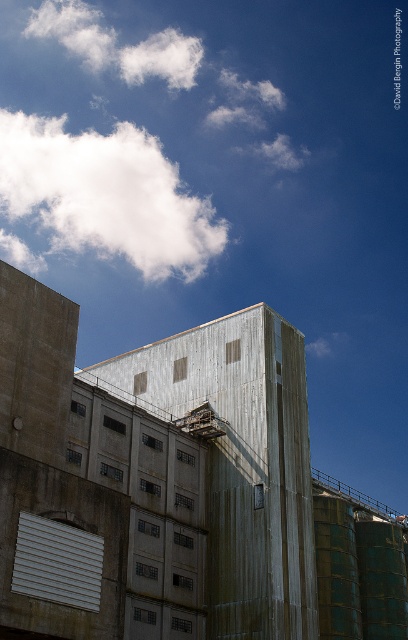
You are standing at the point labeled point [243,461] in the industrial scene. What object are you directly facing?

The point labeled point [243,461] corresponds to the rusty metal silo at center, so you are directly facing the rusty metal silo at center.

You are an architect designing a new industrial complex. You want to place a new structure between the rusty metal silo at center and the white fluffy cloud at upper left. Which object should the new structure be closer to if it needs to be wider than both?

The new structure should be closer to the white fluffy cloud at upper left because the rusty metal silo at center has a lesser width compared to the white fluffy cloud at upper left, so placing it near the wider object allows the structure to be wider than both.